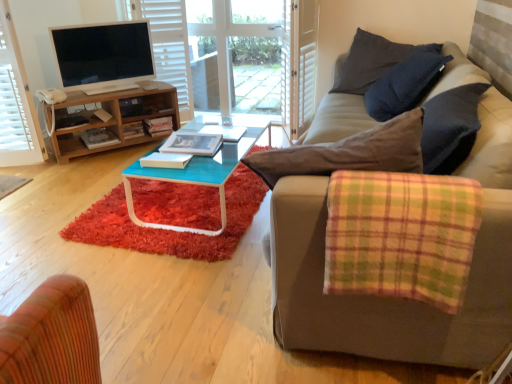
Question: From a real-world perspective, is transparent glass door at upper center physically above white wood screen door at upper center?

Choices:
 (A) no
 (B) yes

Answer: (A)

Question: Can you confirm if transparent glass door at upper center is positioned to the left of white wood screen door at upper center?

Choices:
 (A) no
 (B) yes

Answer: (B)

Question: Is white wood screen door at upper center a part of transparent glass door at upper center?

Choices:
 (A) no
 (B) yes

Answer: (A)

Question: From a real-world perspective, is transparent glass door at upper center beneath white wood screen door at upper center?

Choices:
 (A) no
 (B) yes

Answer: (B)

Question: Does transparent glass door at upper center appear on the right side of white wood screen door at upper center?

Choices:
 (A) yes
 (B) no

Answer: (B)

Question: Can you confirm if transparent glass door at upper center is smaller than white wood screen door at upper center?

Choices:
 (A) yes
 (B) no

Answer: (B)

Question: From a real-world perspective, is wooden entertainment center at left positioned under plaid fabric studio couch at right based on gravity?

Choices:
 (A) yes
 (B) no

Answer: (A)

Question: Is plaid fabric studio couch at right completely or partially inside wooden entertainment center at left?

Choices:
 (A) no
 (B) yes

Answer: (A)

Question: Does wooden entertainment center at left have a lesser height compared to plaid fabric studio couch at right?

Choices:
 (A) no
 (B) yes

Answer: (B)

Question: Considering the relative sizes of wooden entertainment center at left and plaid fabric studio couch at right in the image provided, is wooden entertainment center at left taller than plaid fabric studio couch at right?

Choices:
 (A) yes
 (B) no

Answer: (B)

Question: Is wooden entertainment center at left touching plaid fabric studio couch at right?

Choices:
 (A) no
 (B) yes

Answer: (A)

Question: Is wooden entertainment center at left further to the viewer compared to plaid fabric studio couch at right?

Choices:
 (A) no
 (B) yes

Answer: (B)

Question: Is dark gray cotton pillow at upper right at the left side of shaggy red rug at center?

Choices:
 (A) no
 (B) yes

Answer: (A)